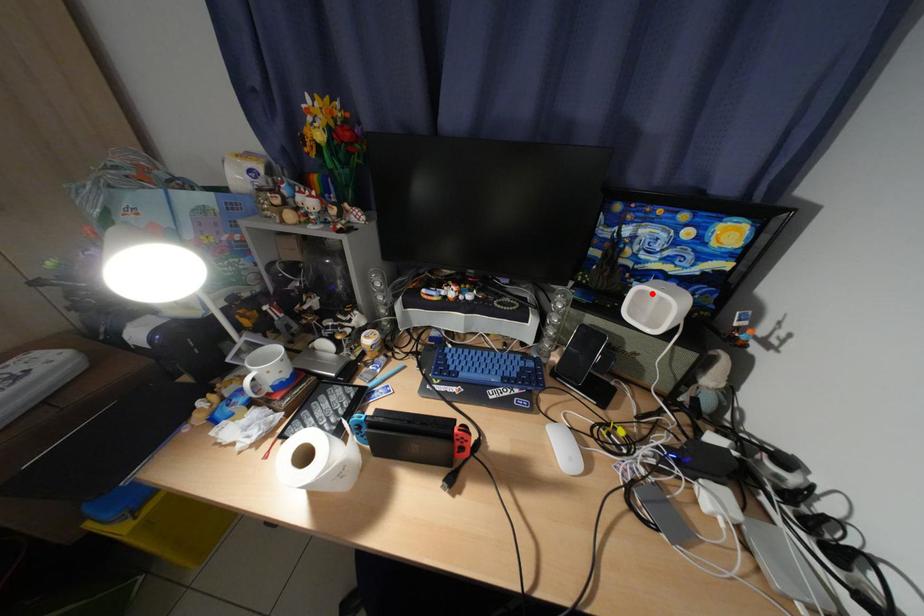
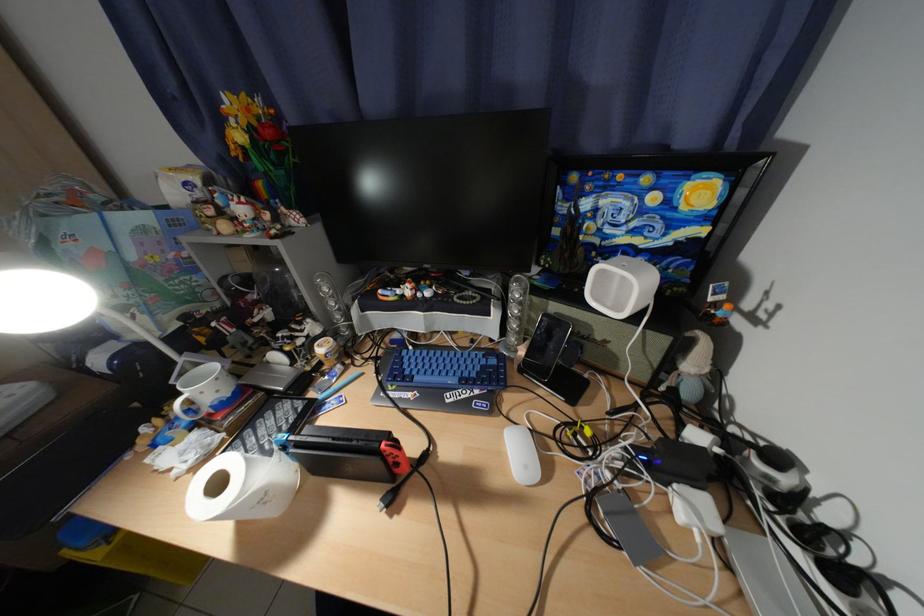
Locate, in the second image, the point that corresponds to the highlighted location in the first image.

(613, 273)